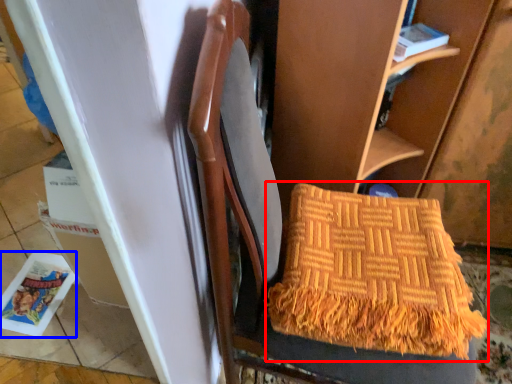
Question: Which object appears closest to the camera in this image, blanket (highlighted by a red box) or magazine (highlighted by a blue box)?

Choices:
 (A) blanket
 (B) magazine

Answer: (A)